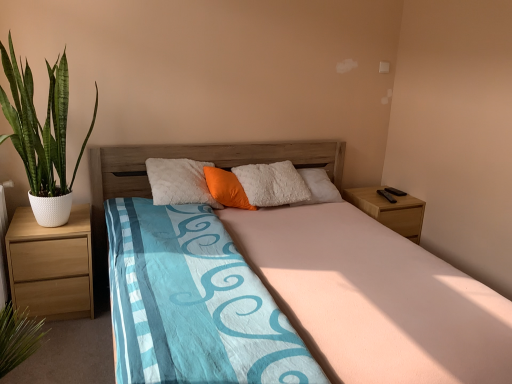
Locate an element on the screen. Image resolution: width=512 pixels, height=384 pixels. wooden bed at center is located at coordinates (374, 298).

What do you see at coordinates (51, 265) in the screenshot? I see `light brown wood at left, which is counted as the 1th nightstand, starting from the front` at bounding box center [51, 265].

Describe the element at coordinates (226, 188) in the screenshot. The height and width of the screenshot is (384, 512). I see `orange fabric pillow at center` at that location.

The width and height of the screenshot is (512, 384). Find the location of `wooden bed at center`. wooden bed at center is located at coordinates (374, 298).

Relative to orange fabric pillow at center, is green leafy plant in textured pot at left in front or behind?

green leafy plant in textured pot at left is in front of orange fabric pillow at center.

Consider the image. Is green leafy plant in textured pot at left oriented towards orange fabric pillow at center?

No, green leafy plant in textured pot at left is not turned towards orange fabric pillow at center.

Is green leafy plant in textured pot at left smaller than orange fabric pillow at center?

No.

Based on the photo, can you confirm if green leafy plant in textured pot at left is positioned to the right of orange fabric pillow at center?

In fact, green leafy plant in textured pot at left is to the left of orange fabric pillow at center.

Can you confirm if light brown wood at left, which is the first nightstand from left to right, is wider than wooden bed at center?

Incorrect, the width of light brown wood at left, which is the first nightstand from left to right, does not surpass that of wooden bed at center.

Based on the photo, is light brown wood at left, which ranks as the second nightstand in back-to-front order, to the right of wooden bed at center from the viewer's perspective?

No, light brown wood at left, which ranks as the second nightstand in back-to-front order, is not to the right of wooden bed at center.

From a real-world perspective, relative to wooden bed at center, is light brown wood at left, which is counted as the 1th nightstand, starting from the front, vertically above or below?

From a real-world perspective, light brown wood at left, which is counted as the 1th nightstand, starting from the front, is physically below wooden bed at center.

How many degrees apart are the facing directions of light brown wood at left, which is the second nightstand in right-to-left order, and wooden bed at center?

The facing directions of light brown wood at left, which is the second nightstand in right-to-left order, and wooden bed at center are 0.554 degrees apart.

Which object is wider, orange fabric pillow at center or wooden nightstand at right, arranged as the second nightstand when viewed from the front?

With larger width is wooden nightstand at right, arranged as the second nightstand when viewed from the front.

Consider the image. Would you consider orange fabric pillow at center to be distant from wooden nightstand at right, which is the 1th nightstand in right-to-left order?

Absolutely, orange fabric pillow at center is distant from wooden nightstand at right, which is the 1th nightstand in right-to-left order.

Could you measure the distance between orange fabric pillow at center and wooden nightstand at right, which is the 1th nightstand in right-to-left order?

They are 1.06 meters apart.

From the picture: Considering the relative sizes of orange fabric pillow at center and wooden nightstand at right, which is the 1th nightstand in right-to-left order, in the image provided, is orange fabric pillow at center taller than wooden nightstand at right, which is the 1th nightstand in right-to-left order,?

Yes.

From the image's perspective, would you say wooden nightstand at right, the second nightstand viewed from the left, is positioned over orange fabric pillow at center?

Incorrect, from the image's perspective, wooden nightstand at right, the second nightstand viewed from the left, is lower than orange fabric pillow at center.

Is wooden nightstand at right, which is the 1th nightstand in right-to-left order, oriented away from orange fabric pillow at center?

No, wooden nightstand at right, which is the 1th nightstand in right-to-left order,'s orientation is not away from orange fabric pillow at center.

From a real-world perspective, who is located higher, wooden nightstand at right, which is counted as the first nightstand, starting from the back, or orange fabric pillow at center?

In real-world perspective, orange fabric pillow at center is above.

From the picture: Can you tell me how much wooden nightstand at right, arranged as the second nightstand when viewed from the front, and orange fabric pillow at center differ in facing direction?

The facing directions of wooden nightstand at right, arranged as the second nightstand when viewed from the front, and orange fabric pillow at center are 53.3 degrees apart.

Is light brown wood at left, which is counted as the 1th nightstand, starting from the front, located outside orange fabric pillow at center?

light brown wood at left, which is counted as the 1th nightstand, starting from the front, is positioned outside orange fabric pillow at center.

From the image's perspective, which is below, light brown wood at left, which ranks as the second nightstand in back-to-front order, or orange fabric pillow at center?

From the image's view, light brown wood at left, which ranks as the second nightstand in back-to-front order, is below.

You are a GUI agent. You are given a task and a screenshot of the screen. Output one action in this format:
    pyautogui.click(x=<x>, y=<y>)
    Task: Click on the nightstand that is in front of the orange fabric pillow at center
    
    Given the screenshot: What is the action you would take?
    pyautogui.click(x=51, y=265)

Would you say light brown wood at left, which ranks as the second nightstand in back-to-front order, is part of orange fabric pillow at center's contents?

No, light brown wood at left, which ranks as the second nightstand in back-to-front order, is located outside of orange fabric pillow at center.

Identify the location of the 2nd nightstand directly beneath the orange fabric pillow at center (from a real-world perspective). (51, 265).

Considering the positions of points (239, 197) and (58, 282), is point (239, 197) closer to camera compared to point (58, 282)?

No, it is not.

How different are the orientations of orange fabric pillow at center and light brown wood at left, which is the second nightstand in right-to-left order, in degrees?

They differ by 53.7 degrees in their facing directions.

Does wooden bed at center turn towards light brown wood at left, which is counted as the 1th nightstand, starting from the front?

No, wooden bed at center does not turn towards light brown wood at left, which is counted as the 1th nightstand, starting from the front.

Is wooden bed at center not within light brown wood at left, which is the first nightstand from left to right?

That's correct, wooden bed at center is outside of light brown wood at left, which is the first nightstand from left to right.

How distant is wooden bed at center from light brown wood at left, which is counted as the 1th nightstand, starting from the front?

wooden bed at center and light brown wood at left, which is counted as the 1th nightstand, starting from the front, are 1.15 meters apart.

From a real-world perspective, is wooden bed at center on top of light brown wood at left, which is the first nightstand from left to right?

Yes, from a real-world perspective, wooden bed at center is above light brown wood at left, which is the first nightstand from left to right.

I want to click on pillow behind the green leafy plant in textured pot at left, so click(226, 188).

Where is `nightstand below the wooden bed at center (from the image's perspective)`? nightstand below the wooden bed at center (from the image's perspective) is located at coordinates (51, 265).

Based on their spatial positions, is wooden nightstand at right, which is counted as the first nightstand, starting from the back, or wooden bed at center closer to light brown wood at left, which is the first nightstand from left to right?

wooden bed at center is closer to light brown wood at left, which is the first nightstand from left to right.

Based on their spatial positions, is green leafy plant in textured pot at left or wooden bed at center closer to light brown wood at left, which ranks as the second nightstand in back-to-front order?

green leafy plant in textured pot at left is positioned closer to the anchor light brown wood at left, which ranks as the second nightstand in back-to-front order.

Estimate the real-world distances between objects in this image. Which object is closer to green leafy plant in textured pot at left, light brown wood at left, which is counted as the 1th nightstand, starting from the front, or orange fabric pillow at center?

light brown wood at left, which is counted as the 1th nightstand, starting from the front, is positioned closer to the anchor green leafy plant in textured pot at left.

Estimate the real-world distances between objects in this image. Which object is further from green leafy plant in textured pot at left, wooden bed at center or wooden nightstand at right, the second nightstand viewed from the left?

wooden nightstand at right, the second nightstand viewed from the left.

When comparing their distances from wooden bed at center, does orange fabric pillow at center or light brown wood at left, which is the first nightstand from left to right, seem further?

The object further to wooden bed at center is light brown wood at left, which is the first nightstand from left to right.

Looking at the image, which one is located further to wooden nightstand at right, which is counted as the first nightstand, starting from the back, light brown wood at left, which is the second nightstand in right-to-left order, or wooden bed at center?

light brown wood at left, which is the second nightstand in right-to-left order, is further to wooden nightstand at right, which is counted as the first nightstand, starting from the back.

Based on their spatial positions, is wooden bed at center or wooden nightstand at right, which is the 1th nightstand in right-to-left order, closer to orange fabric pillow at center?

Based on the image, wooden bed at center appears to be nearer to orange fabric pillow at center.

Based on their spatial positions, is wooden nightstand at right, the second nightstand viewed from the left, or light brown wood at left, which ranks as the second nightstand in back-to-front order, further from wooden bed at center?

Based on the image, light brown wood at left, which ranks as the second nightstand in back-to-front order, appears to be further to wooden bed at center.

Identify the location of nightstand between wooden bed at center and wooden nightstand at right, the second nightstand viewed from the left, in the front-back direction. This screenshot has height=384, width=512. [x=51, y=265].

Identify the location of houseplant located between light brown wood at left, which is the second nightstand in right-to-left order, and wooden nightstand at right, arranged as the second nightstand when viewed from the front, in the left-right direction. The width and height of the screenshot is (512, 384). (42, 135).

Find the location of a particular element. This screenshot has height=384, width=512. houseplant situated between light brown wood at left, which is the second nightstand in right-to-left order, and orange fabric pillow at center from left to right is located at coordinates (42, 135).

I want to click on houseplant between light brown wood at left, which is the second nightstand in right-to-left order, and wooden bed at center, in the horizontal direction, so click(42, 135).